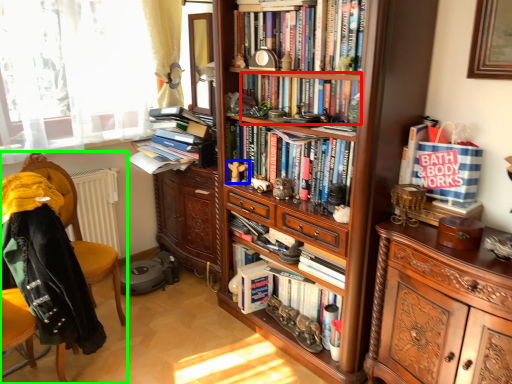
Question: Considering the real-world distances, which object is farthest from book (highlighted by a red box)? toy (highlighted by a blue box) or chair (highlighted by a green box)?

Choices:
 (A) toy
 (B) chair

Answer: (B)